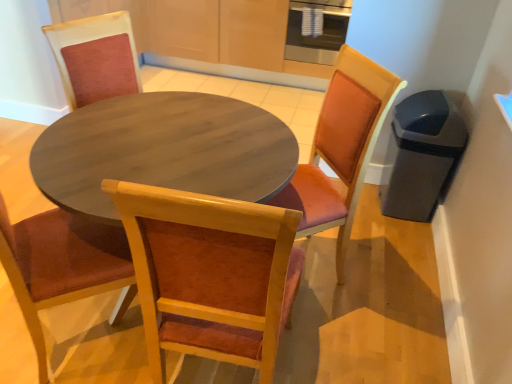
This screenshot has width=512, height=384. What do you see at coordinates (210, 274) in the screenshot?
I see `wooden chair at center, arranged as the second chair when viewed from the back` at bounding box center [210, 274].

This screenshot has height=384, width=512. I want to click on stainless steel oven at upper center, so click(317, 35).

I want to click on wooden chair at center, acting as the first chair starting from the front, so click(210, 274).

Which object is positioned more to the right, wooden chair with orange cushion at center, positioned as the 2th chair in front-to-back order, or wooden chair at center, acting as the first chair starting from the front?

Positioned to the right is wooden chair with orange cushion at center, positioned as the 2th chair in front-to-back order.

Is wooden chair with orange cushion at center, positioned as the 2th chair in front-to-back order, situated inside wooden chair at center, acting as the first chair starting from the front, or outside?

wooden chair with orange cushion at center, positioned as the 2th chair in front-to-back order, lies outside wooden chair at center, acting as the first chair starting from the front.

From the image's perspective, is wooden chair with orange cushion at center, which appears as the 1th chair when viewed from the back, positioned above or below wooden chair at center, acting as the first chair starting from the front?

Clearly, from the image's perspective, wooden chair with orange cushion at center, which appears as the 1th chair when viewed from the back, is above wooden chair at center, acting as the first chair starting from the front.

Does stainless steel oven at upper center have a smaller size compared to wooden chair with orange cushion at center, which appears as the 1th chair when viewed from the back?

Yes, stainless steel oven at upper center is smaller than wooden chair with orange cushion at center, which appears as the 1th chair when viewed from the back.

Considering the sizes of objects stainless steel oven at upper center and wooden chair with orange cushion at center, which appears as the 1th chair when viewed from the back, in the image provided, who is taller, stainless steel oven at upper center or wooden chair with orange cushion at center, which appears as the 1th chair when viewed from the back,?

wooden chair with orange cushion at center, which appears as the 1th chair when viewed from the back, is taller.

Is stainless steel oven at upper center thinner than wooden chair with orange cushion at center, positioned as the 2th chair in front-to-back order?

Correct, the width of stainless steel oven at upper center is less than that of wooden chair with orange cushion at center, positioned as the 2th chair in front-to-back order.

Is stainless steel oven at upper center to the right of wooden chair with orange cushion at center, which appears as the 1th chair when viewed from the back, from the viewer's perspective?

Yes.

Based on the photo, considering their positions, is wooden chair at center, arranged as the second chair when viewed from the back, located in front of or behind stainless steel oven at upper center?

wooden chair at center, arranged as the second chair when viewed from the back, is in front of stainless steel oven at upper center.

Do you think wooden chair at center, acting as the first chair starting from the front, is within stainless steel oven at upper center, or outside of it?

wooden chair at center, acting as the first chair starting from the front, is spatially situated outside stainless steel oven at upper center.

You are a GUI agent. You are given a task and a screenshot of the screen. Output one action in this format:
    pyautogui.click(x=<x>, y=<y>)
    Task: Click on the appliance above the wooden chair at center, acting as the first chair starting from the front (from a real-world perspective)
    
    Given the screenshot: What is the action you would take?
    pyautogui.click(x=317, y=35)

Can you confirm if stainless steel oven at upper center is bigger than wooden chair at center, acting as the first chair starting from the front?

No, stainless steel oven at upper center is not bigger than wooden chair at center, acting as the first chair starting from the front.

Is stainless steel oven at upper center beside wooden chair at center, arranged as the second chair when viewed from the back?

There is a gap between stainless steel oven at upper center and wooden chair at center, arranged as the second chair when viewed from the back.

Does point (293, 35) come behind point (181, 260)?

Yes.

Is wooden chair at center, arranged as the second chair when viewed from the back, at the back of stainless steel oven at upper center?

No, stainless steel oven at upper center is not facing away from wooden chair at center, arranged as the second chair when viewed from the back.

Looking at this image, from a real-world perspective, is wooden chair at center, arranged as the second chair when viewed from the back, below wooden chair with orange cushion at center, positioned as the 2th chair in front-to-back order?

No, from a real-world perspective, wooden chair at center, arranged as the second chair when viewed from the back, is not below wooden chair with orange cushion at center, positioned as the 2th chair in front-to-back order.

From the picture: Which object is wider, wooden chair at center, acting as the first chair starting from the front, or wooden chair with orange cushion at center, which appears as the 1th chair when viewed from the back?

wooden chair with orange cushion at center, which appears as the 1th chair when viewed from the back.

Considering the sizes of wooden chair at center, acting as the first chair starting from the front, and wooden chair with orange cushion at center, which appears as the 1th chair when viewed from the back, in the image, is wooden chair at center, acting as the first chair starting from the front, taller or shorter than wooden chair with orange cushion at center, which appears as the 1th chair when viewed from the back,?

Clearly, wooden chair at center, acting as the first chair starting from the front, is taller compared to wooden chair with orange cushion at center, which appears as the 1th chair when viewed from the back.

Is wooden chair at center, acting as the first chair starting from the front, further to camera compared to wooden chair with orange cushion at center, which appears as the 1th chair when viewed from the back?

No, wooden chair at center, acting as the first chair starting from the front, is in front of wooden chair with orange cushion at center, which appears as the 1th chair when viewed from the back.

Between point (311, 168) and point (311, 6), which one is positioned in front?

The point (311, 168) is closer.

Consider the image. Between wooden chair with orange cushion at center, which appears as the 1th chair when viewed from the back, and stainless steel oven at upper center, which one appears on the right side from the viewer's perspective?

From the viewer's perspective, stainless steel oven at upper center appears more on the right side.

From the image's perspective, count 1st chairs downward from the stainless steel oven at upper center and point to it. Please provide its 2D coordinates.

[(341, 148)]

Locate an element on the screen. This screenshot has height=384, width=512. chair on the left side of wooden chair with orange cushion at center, positioned as the 2th chair in front-to-back order is located at coordinates (210, 274).

There is a stainless steel oven at upper center. Identify the location of the 2nd chair below it (from a real-world perspective). The image size is (512, 384). (341, 148).

Considering their positions, is stainless steel oven at upper center positioned closer to wooden chair at center, acting as the first chair starting from the front, than wooden chair with orange cushion at center, which appears as the 1th chair when viewed from the back?

Among the two, wooden chair with orange cushion at center, which appears as the 1th chair when viewed from the back, is located nearer to wooden chair at center, acting as the first chair starting from the front.

When comparing their distances from stainless steel oven at upper center, does wooden chair at center, arranged as the second chair when viewed from the back, or wooden chair with orange cushion at center, which appears as the 1th chair when viewed from the back, seem further?

wooden chair at center, arranged as the second chair when viewed from the back, lies further to stainless steel oven at upper center than the other object.

Based on their spatial positions, is stainless steel oven at upper center or wooden chair at center, acting as the first chair starting from the front, closer to wooden chair with orange cushion at center, positioned as the 2th chair in front-to-back order?

wooden chair at center, acting as the first chair starting from the front, is closer to wooden chair with orange cushion at center, positioned as the 2th chair in front-to-back order.

From the image, which object appears to be farther from wooden chair with orange cushion at center, positioned as the 2th chair in front-to-back order, wooden chair at center, acting as the first chair starting from the front, or stainless steel oven at upper center?

The object further to wooden chair with orange cushion at center, positioned as the 2th chair in front-to-back order, is stainless steel oven at upper center.

From the image, which object appears to be nearer to stainless steel oven at upper center, wooden chair with orange cushion at center, positioned as the 2th chair in front-to-back order, or wooden chair at center, acting as the first chair starting from the front?

Based on the image, wooden chair with orange cushion at center, positioned as the 2th chair in front-to-back order, appears to be nearer to stainless steel oven at upper center.

Looking at this image, looking at the image, which one is located closer to wooden chair at center, arranged as the second chair when viewed from the back, wooden chair with orange cushion at center, which appears as the 1th chair when viewed from the back, or stainless steel oven at upper center?

The object closer to wooden chair at center, arranged as the second chair when viewed from the back, is wooden chair with orange cushion at center, which appears as the 1th chair when viewed from the back.

Where is `chair between wooden chair at center, acting as the first chair starting from the front, and stainless steel oven at upper center from front to back`? chair between wooden chair at center, acting as the first chair starting from the front, and stainless steel oven at upper center from front to back is located at coordinates (341, 148).